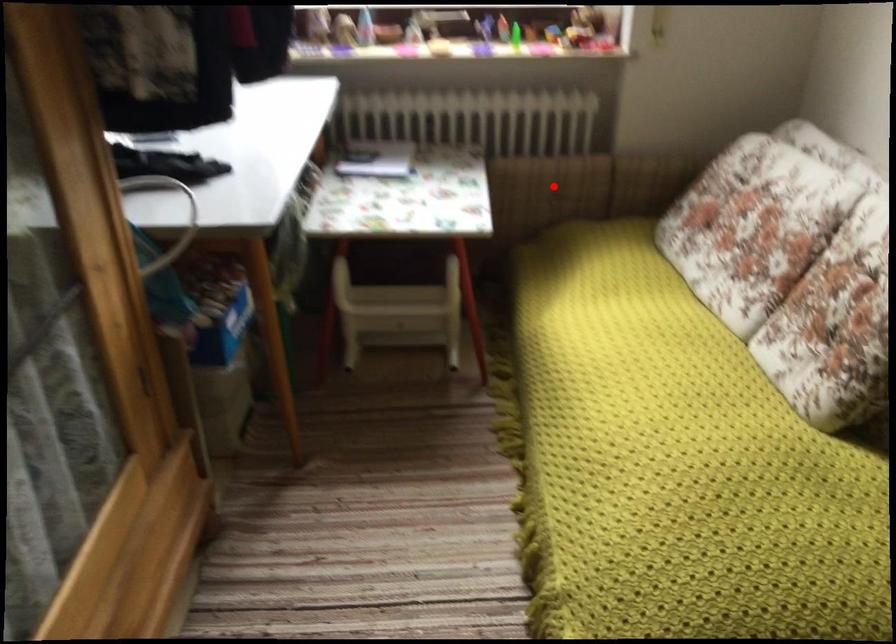
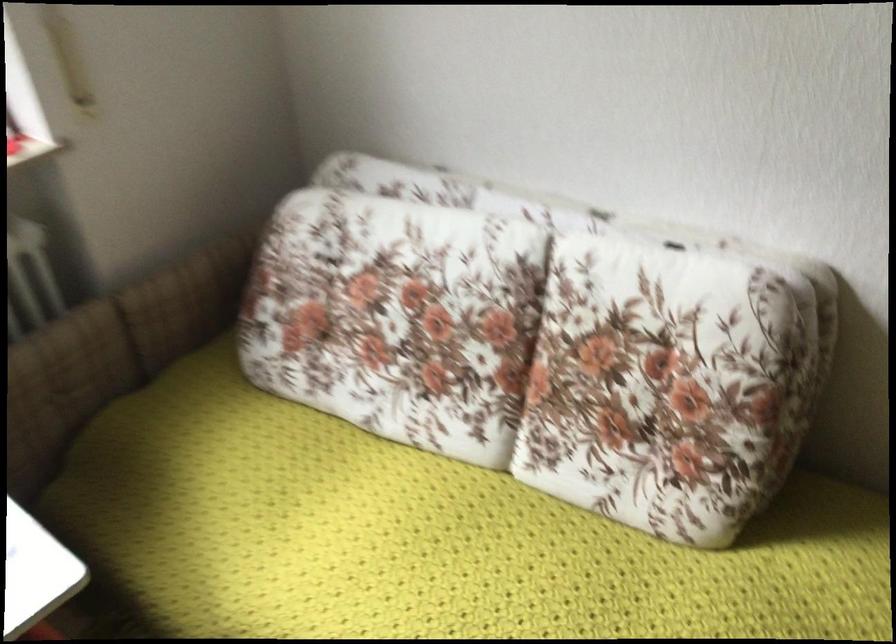
Question: I am providing you with two images of the same scene from different viewpoints. A red point is shown in image1. For the corresponding object point in image2, is it positioned nearer or farther from the camera?

Choices:
 (A) Nearer
 (B) Farther

Answer: (A)